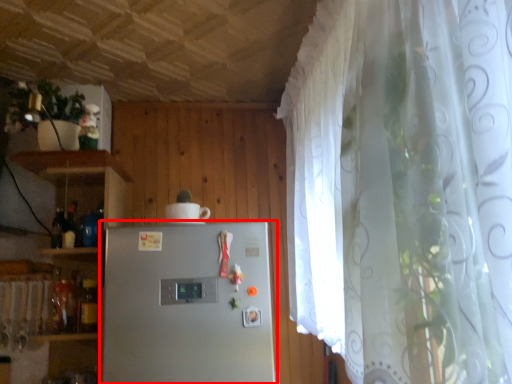
Question: From the image's perspective, what is the correct spatial positioning of refrigerator (annotated by the red box) in reference to appliance?

Choices:
 (A) below
 (B) above

Answer: (A)